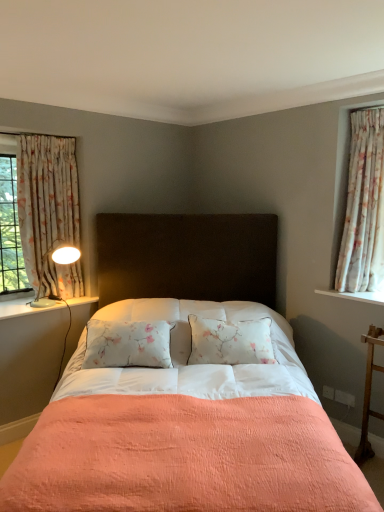
Question: Is white glossy lamp at left to the right of floral fabric curtain at right, the 1th curtain viewed from the right, from the viewer's perspective?

Choices:
 (A) no
 (B) yes

Answer: (A)

Question: Could floral fabric curtain at right, the 1th curtain viewed from the right, be considered to be inside white glossy lamp at left?

Choices:
 (A) no
 (B) yes

Answer: (A)

Question: From the image's perspective, would you say white glossy lamp at left is positioned over floral fabric curtain at right, the second curtain from the left?

Choices:
 (A) no
 (B) yes

Answer: (A)

Question: Does white glossy lamp at left have a greater width compared to floral fabric curtain at right, the second curtain from the left?

Choices:
 (A) yes
 (B) no

Answer: (A)

Question: Does white glossy lamp at left turn towards floral fabric curtain at right, the 1th curtain viewed from the right?

Choices:
 (A) no
 (B) yes

Answer: (A)

Question: Does point (188, 266) appear closer or farther from the camera than point (362, 160)?

Choices:
 (A) farther
 (B) closer

Answer: (A)

Question: Is peachy fabric bed at center to the left or to the right of floral fabric curtain at right, the 1th curtain viewed from the right, in the image?

Choices:
 (A) right
 (B) left

Answer: (B)

Question: Based on their sizes in the image, would you say peachy fabric bed at center is bigger or smaller than floral fabric curtain at right, the 1th curtain viewed from the right?

Choices:
 (A) big
 (B) small

Answer: (A)

Question: From the image's perspective, is peachy fabric bed at center located above or below floral fabric curtain at right, the 1th curtain viewed from the right?

Choices:
 (A) below
 (B) above

Answer: (A)

Question: Is point (33, 305) closer or farther from the camera than point (61, 161)?

Choices:
 (A) farther
 (B) closer

Answer: (B)

Question: Is white glossy lamp at left taller or shorter than floral fabric curtain at left, the second curtain in the right-to-left sequence?

Choices:
 (A) tall
 (B) short

Answer: (B)

Question: Relative to floral fabric curtain at left, which appears as the 1th curtain when viewed from the left, is white glossy lamp at left in front or behind?

Choices:
 (A) behind
 (B) front

Answer: (B)

Question: Do you think white glossy lamp at left is within floral fabric curtain at left, which appears as the 1th curtain when viewed from the left, or outside of it?

Choices:
 (A) inside
 (B) outside

Answer: (A)

Question: Is point (1, 307) positioned closer to the camera than point (21, 157)?

Choices:
 (A) farther
 (B) closer

Answer: (B)

Question: Do you think white painted wood at left is within floral fabric curtain at left, which appears as the 1th curtain when viewed from the left, or outside of it?

Choices:
 (A) inside
 (B) outside

Answer: (B)